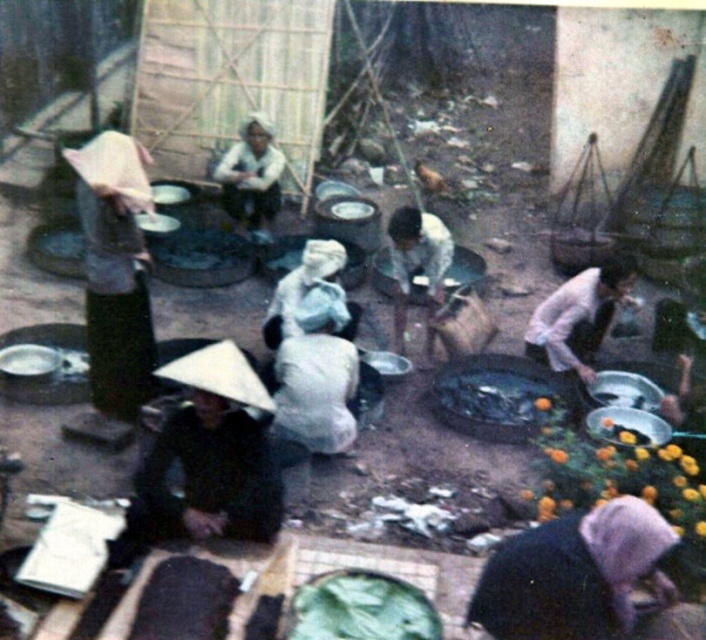
You are a vendor at this market and need to cover your goods with a material that is large enough. Which object between the matte black conical hat at left and the light pink fabric at lower right would you choose and why?

The matte black conical hat at left has a larger size compared to the light pink fabric at lower right, so it would be the better choice to cover your goods as it can provide a larger coverage area.

You are a vendor at the market and need to place a new item between the matte black conical hat at left and the light pink fabric at lower right. Where should you position it?

You should place the new item between the matte black conical hat at left and the light pink fabric at lower right, as the matte black conical hat at left is to the left of the light pink fabric at lower right.

You are a customer at the market and want to buy a hat. You see the matte black conical hat at left and the light pink fabric at lower right. Which item is positioned higher up in the scene?

The matte black conical hat at left is located above the light pink fabric at lower right, so it is positioned higher up in the scene.